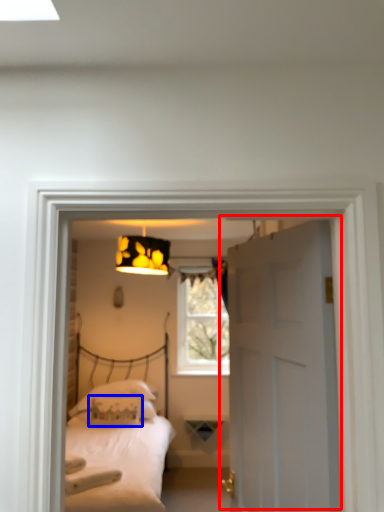
Question: Which object is further to the camera taking this photo, door (highlighted by a red box) or pillow (highlighted by a blue box)?

Choices:
 (A) door
 (B) pillow

Answer: (B)